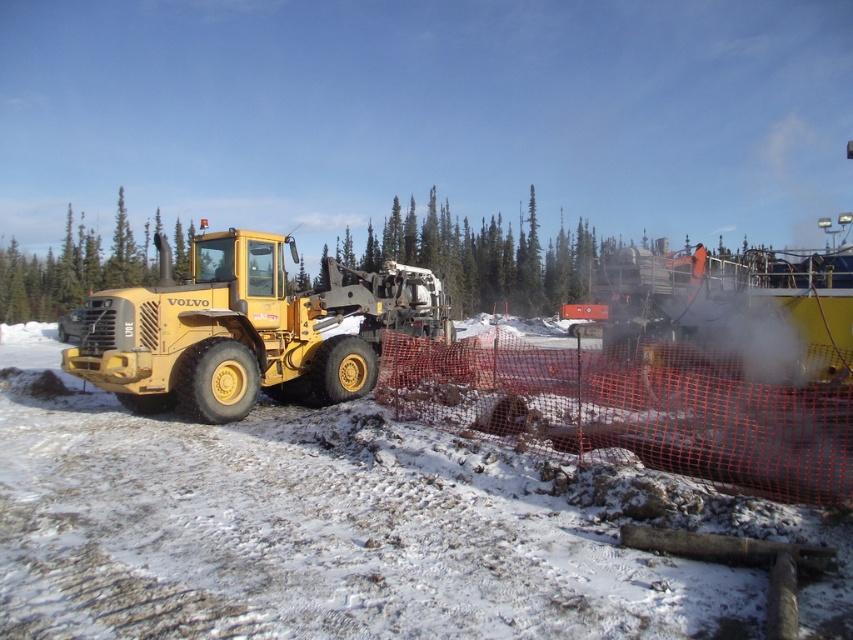
You are a construction worker standing at the edge of the snowy site. You need to move from the green leafy tree at center to the matte yellow tractor at left. Which direction should you walk to reach the tractor?

The matte yellow tractor at left is positioned on the right side of green leafy tree at center. Therefore, to reach the tractor, you should walk to the right side of the green leafy tree at center.

You are an engineer assessing the construction site. You need to determine the relative sizes of the matte yellow tractor at left and the green leafy tree at center. Which object is larger?

The green leafy tree at center is larger than the matte yellow tractor at left.